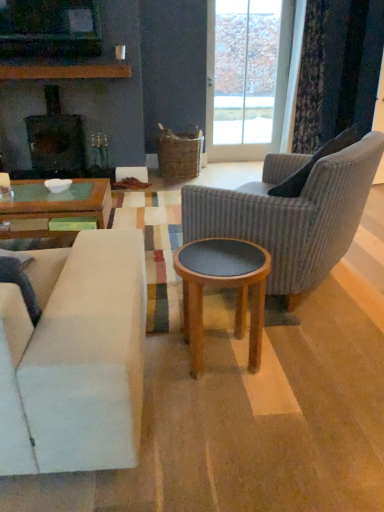
Question: Does white fabric couch at left appear on the right side of white glossy bowl at center?

Choices:
 (A) yes
 (B) no

Answer: (A)

Question: Can you confirm if white fabric couch at left is wider than white glossy bowl at center?

Choices:
 (A) yes
 (B) no

Answer: (A)

Question: Is the surface of white fabric couch at left in direct contact with white glossy bowl at center?

Choices:
 (A) no
 (B) yes

Answer: (A)

Question: Is the depth of white fabric couch at left greater than that of white glossy bowl at center?

Choices:
 (A) no
 (B) yes

Answer: (A)

Question: From a real-world perspective, is white fabric couch at left below white glossy bowl at center?

Choices:
 (A) no
 (B) yes

Answer: (B)

Question: Considering the positions of point (110, 302) and point (94, 47), is point (110, 302) closer or farther from the camera than point (94, 47)?

Choices:
 (A) farther
 (B) closer

Answer: (B)

Question: Is white fabric couch at left in front of or behind matte black television at upper left in the image?

Choices:
 (A) front
 (B) behind

Answer: (A)

Question: Do you think white fabric couch at left is within matte black television at upper left, or outside of it?

Choices:
 (A) outside
 (B) inside

Answer: (A)

Question: In terms of size, does white fabric couch at left appear bigger or smaller than matte black television at upper left?

Choices:
 (A) big
 (B) small

Answer: (A)

Question: Considering the positions of ribbed fabric armchair at right and transparent glass door at upper center in the image, is ribbed fabric armchair at right wider or thinner than transparent glass door at upper center?

Choices:
 (A) wide
 (B) thin

Answer: (A)

Question: Choose the correct answer: Is ribbed fabric armchair at right inside transparent glass door at upper center or outside it?

Choices:
 (A) inside
 (B) outside

Answer: (B)

Question: From the image's perspective, relative to transparent glass door at upper center, is ribbed fabric armchair at right above or below?

Choices:
 (A) above
 (B) below

Answer: (B)

Question: Is ribbed fabric armchair at right taller or shorter than transparent glass door at upper center?

Choices:
 (A) short
 (B) tall

Answer: (A)

Question: Is wooden round stool at center in front of or behind dark gray fabric pillow at right in the image?

Choices:
 (A) front
 (B) behind

Answer: (A)

Question: Would you say wooden round stool at center is to the left or to the right of dark gray fabric pillow at right in the picture?

Choices:
 (A) right
 (B) left

Answer: (B)